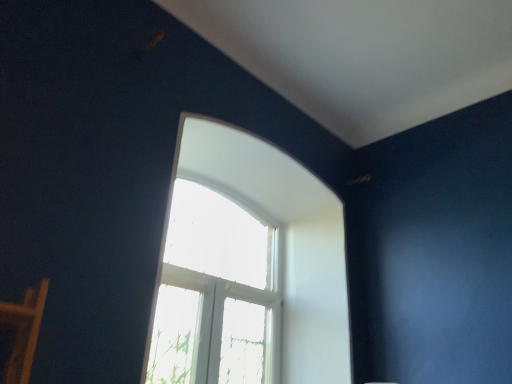
The height and width of the screenshot is (384, 512). Describe the element at coordinates (282, 243) in the screenshot. I see `white glass window at center` at that location.

Where is `white glass window at center`? white glass window at center is located at coordinates (282, 243).

Where is `white glass window at center`? This screenshot has height=384, width=512. white glass window at center is located at coordinates (282, 243).